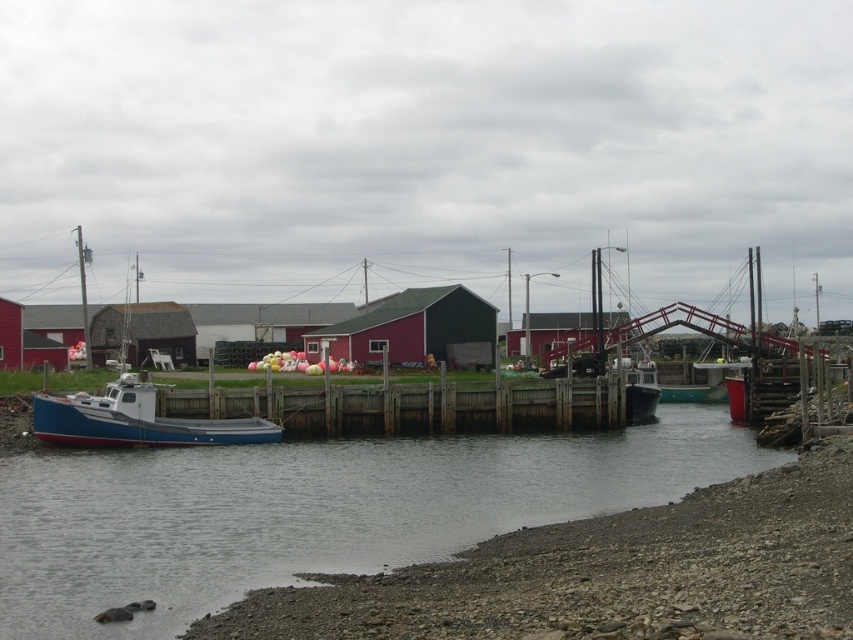
Who is shorter, blue matte water at lower left or red wood barn at left?

Standing shorter between the two is blue matte water at lower left.

Locate an element on the screen. Image resolution: width=853 pixels, height=640 pixels. blue matte water at lower left is located at coordinates (312, 512).

Can you confirm if blue matte water at lower left is positioned below red corrugated metal hut at center?

Correct, blue matte water at lower left is located below red corrugated metal hut at center.

Is blue matte water at lower left wider than red corrugated metal hut at center?

Yes.

Which is in front, point (250, 547) or point (546, 332)?

Point (250, 547) is more forward.

The height and width of the screenshot is (640, 853). Find the location of `blue matte water at lower left`. blue matte water at lower left is located at coordinates (312, 512).

Does red wood barn at center appear on the right side of red wood barn at left?

Correct, you'll find red wood barn at center to the right of red wood barn at left.

You are a GUI agent. You are given a task and a screenshot of the screen. Output one action in this format:
    pyautogui.click(x=<x>, y=<y>)
    Task: Click on the red wood barn at center
    
    Given the screenshot: What is the action you would take?
    pyautogui.click(x=415, y=330)

You are a GUI agent. You are given a task and a screenshot of the screen. Output one action in this format:
    pyautogui.click(x=<x>, y=<y>)
    Task: Click on the red wood barn at center
    This screenshot has width=853, height=640.
    Given the screenshot: What is the action you would take?
    pyautogui.click(x=415, y=330)